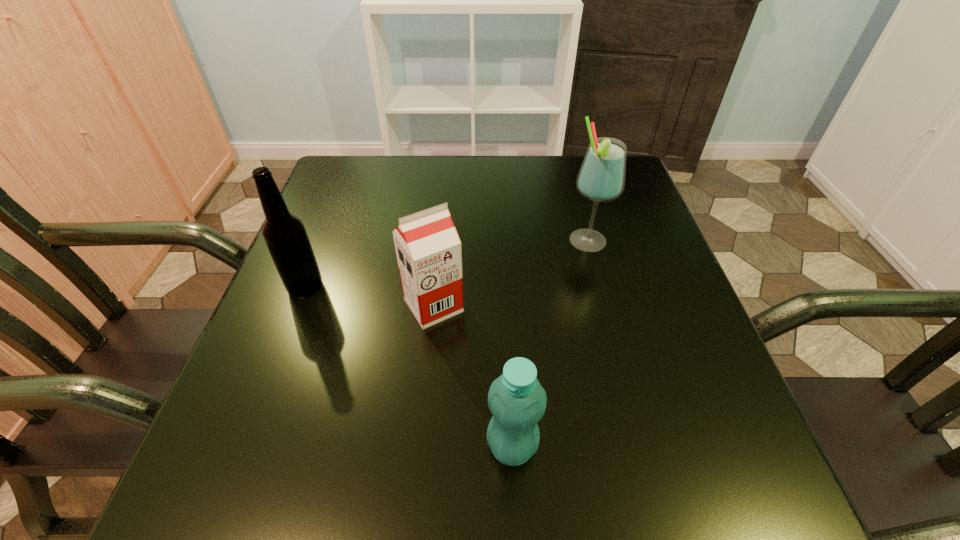
Image resolution: width=960 pixels, height=540 pixels. In order to click on vacant space that's between the third object from right to left and the beer bottle in this screenshot , I will do `click(370, 296)`.

The width and height of the screenshot is (960, 540). Identify the location of vacant area that lies between the third object from right to left and the beer bottle. (370, 296).

Where is `vacant region between the second object from right to left and the leftmost object`? vacant region between the second object from right to left and the leftmost object is located at coordinates (409, 367).

At what (x,y) coordinates should I click in order to perform the action: click on vacant space that's between the second object from right to left and the farthest object. Please return your answer as a coordinate pair (x, y). Looking at the image, I should click on (549, 344).

Identify the location of vacant area between the soya milk and the leftmost object. (370, 296).

The width and height of the screenshot is (960, 540). Find the location of `vacant area between the third object from right to left and the farthest object`. vacant area between the third object from right to left and the farthest object is located at coordinates (511, 274).

At what (x,y) coordinates should I click in order to perform the action: click on unoccupied position between the nearest object and the beer bottle. Please return your answer as a coordinate pair (x, y). Looking at the image, I should click on (409, 367).

Select which object appears as the second closest to the farthest object. Please provide its 2D coordinates. Your answer should be formatted as a tuple, i.e. [(x, y)], where the tuple contains the x and y coordinates of a point satisfying the conditions above.

[(516, 399)]

Where is `object that stands as the closest to the farthest object`? object that stands as the closest to the farthest object is located at coordinates (428, 248).